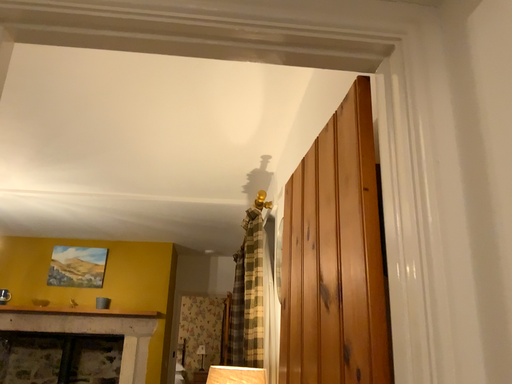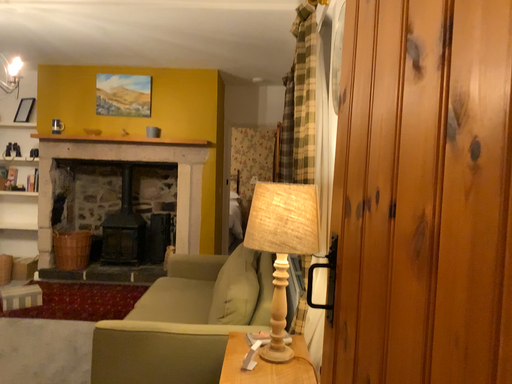
Question: Which way did the camera rotate in the video?

Choices:
 (A) rotated downward
 (B) rotated upward

Answer: (A)